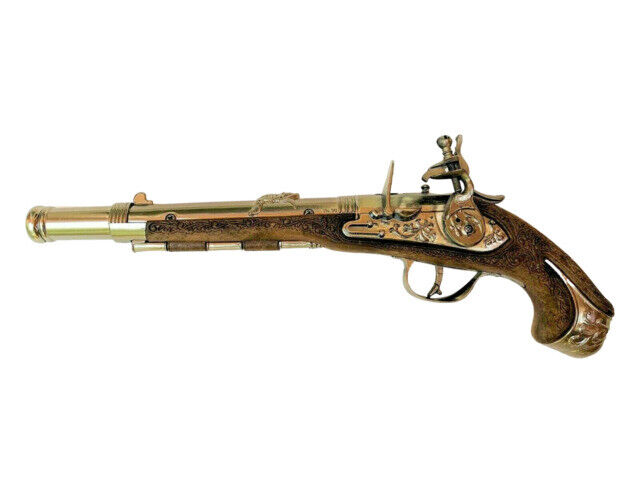
What are the coordinates of `wood design` in the screenshot? It's located at (545, 303), (525, 240), (198, 226), (193, 246), (260, 248), (404, 249), (595, 291).